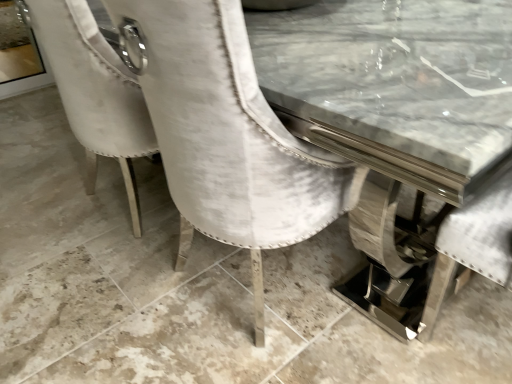
Where is `vacant space positioned to the left of velvet white chair at center`? The width and height of the screenshot is (512, 384). vacant space positioned to the left of velvet white chair at center is located at coordinates (105, 280).